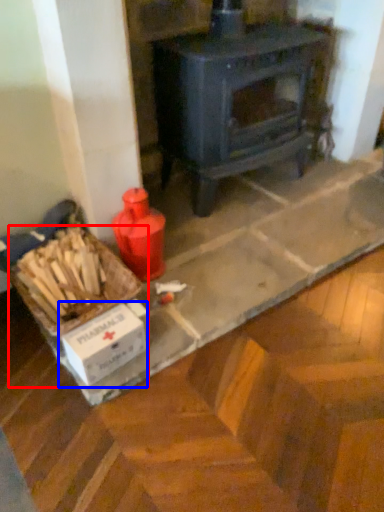
Question: Which object appears farthest to the camera in this image, box (highlighted by a red box) or cardboard box (highlighted by a blue box)?

Choices:
 (A) box
 (B) cardboard box

Answer: (A)